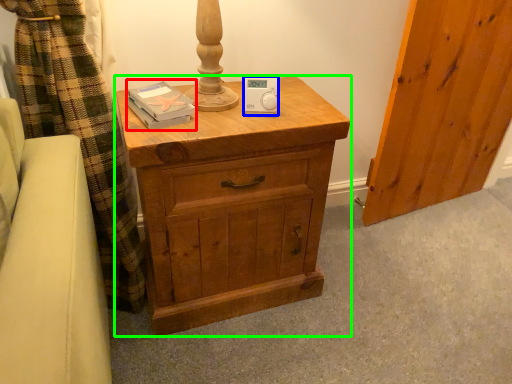
Question: Considering the real-world distances, which object is closest to book (highlighted by a red box)? ipod (highlighted by a blue box) or chest of drawers (highlighted by a green box).

Choices:
 (A) ipod
 (B) chest of drawers

Answer: (A)